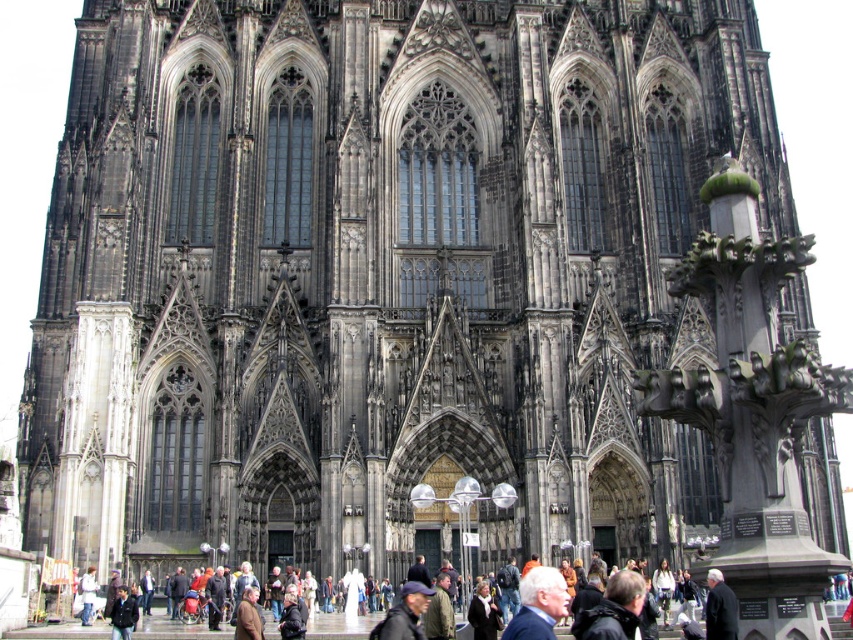
Question: Is blue fabric jacket at lower center thinner than dark brown leather jacket at lower left?

Choices:
 (A) yes
 (B) no

Answer: (B)

Question: Which object appears farthest from the camera in this image?

Choices:
 (A) dark brown leather jacket at lower left
 (B) blue fabric jacket at lower center

Answer: (A)

Question: Can you confirm if blue fabric jacket at lower center is wider than dark brown leather jacket at lower left?

Choices:
 (A) no
 (B) yes

Answer: (B)

Question: Is blue fabric jacket at lower center below dark brown leather jacket at lower left?

Choices:
 (A) yes
 (B) no

Answer: (B)